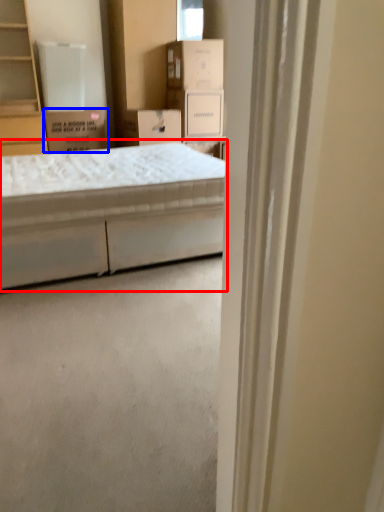
Question: Among these objects, which one is farthest to the camera, bed (highlighted by a red box) or cardboard box (highlighted by a blue box)?

Choices:
 (A) bed
 (B) cardboard box

Answer: (B)